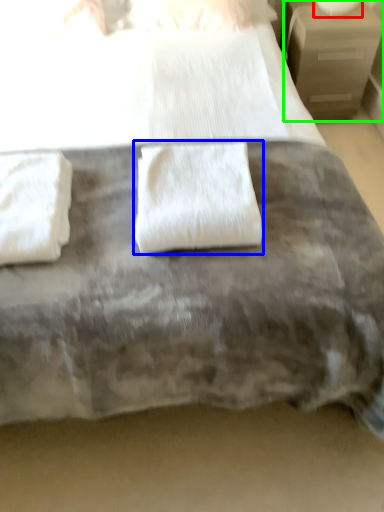
Question: Estimate the real-world distances between objects in this image. Which object is closer to table lamp (highlighted by a red box), towel (highlighted by a blue box) or nightstand (highlighted by a green box)?

Choices:
 (A) towel
 (B) nightstand

Answer: (B)